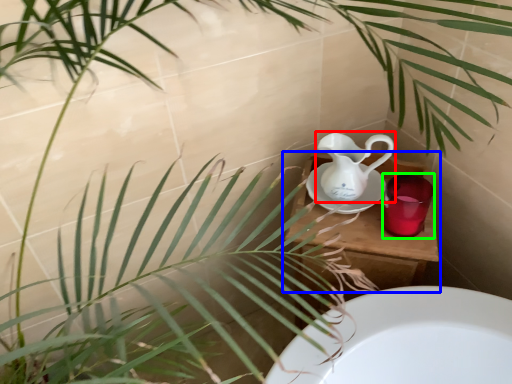
Question: Based on their relative distances, which object is nearer to jug (highlighted by a red box)? Choose from table (highlighted by a blue box) and mug (highlighted by a green box).

Choices:
 (A) table
 (B) mug

Answer: (A)